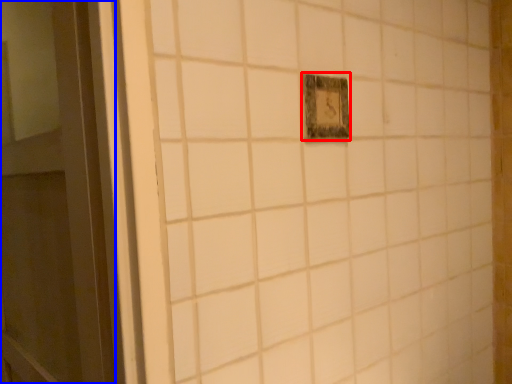
Question: Which of the following is the farthest to the observer, light switch (highlighted by a red box) or door (highlighted by a blue box)?

Choices:
 (A) light switch
 (B) door

Answer: (A)